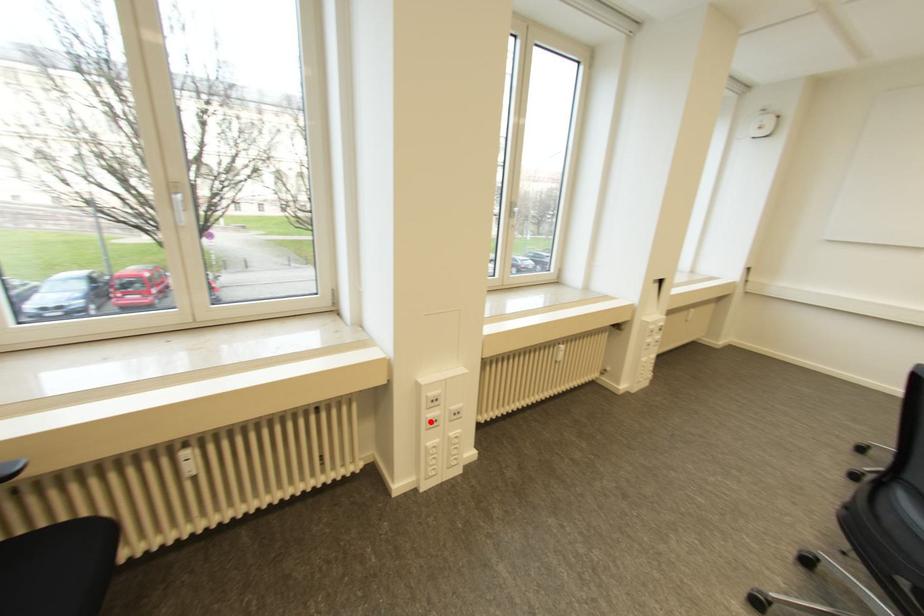
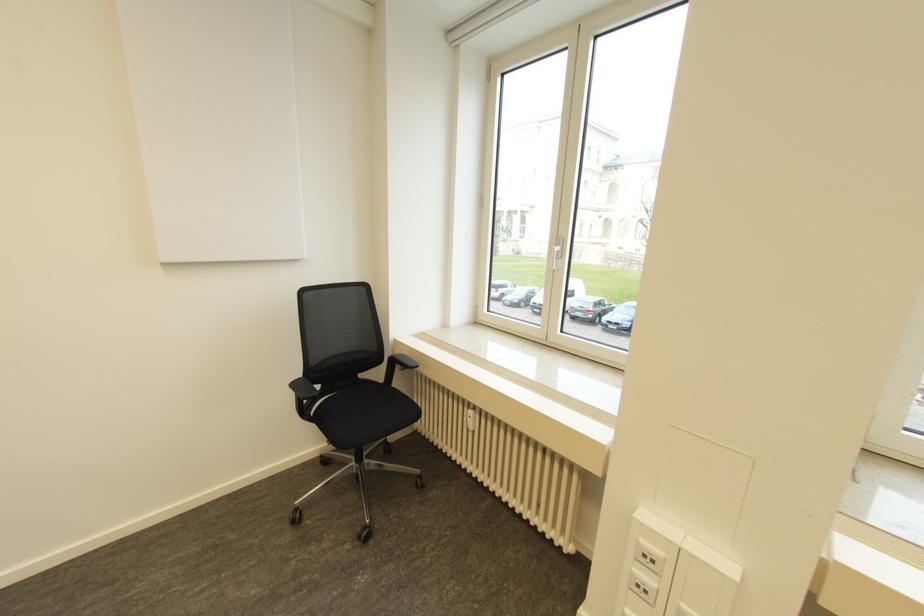
In the second image, find the point that corresponds to the highlighted location in the first image.

(637, 585)